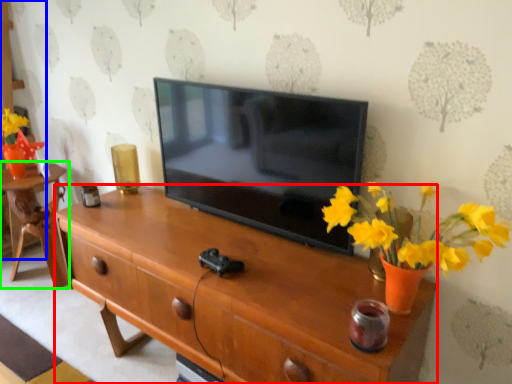
Question: Considering the real-world distances, which object is farthest from desk (highlighted by a red box)? cabinetry (highlighted by a blue box) or table (highlighted by a green box)?

Choices:
 (A) cabinetry
 (B) table

Answer: (A)